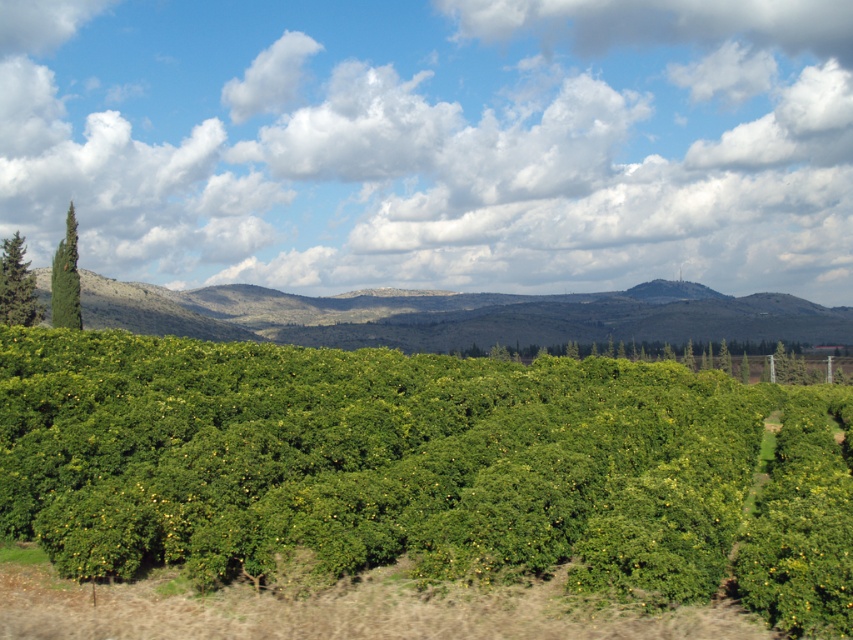
Who is positioned more to the left, green leafy hedge at center or green leafy hillside at center?

green leafy hedge at center

Does green leafy hedge at center appear under green leafy hillside at center?

Yes.

Is point (798, 472) positioned behind point (364, 304)?

No, (798, 472) is closer to viewer.

The image size is (853, 640). Identify the location of green leafy hedge at center. (421, 468).

Is point (445, 332) in front of point (74, 272)?

That is False.

Does point (283, 292) come farther from viewer compared to point (68, 300)?

That is True.

This screenshot has width=853, height=640. What do you see at coordinates (459, 316) in the screenshot? I see `green leafy hillside at center` at bounding box center [459, 316].

Identify the location of green leafy hillside at center. (459, 316).

Is green leafy hillside at center behind green leafy tree at left?

Yes, it is.

Which is above, green leafy hillside at center or green leafy tree at left?

green leafy tree at left is above.

The height and width of the screenshot is (640, 853). What do you see at coordinates (459, 316) in the screenshot? I see `green leafy hillside at center` at bounding box center [459, 316].

You are a GUI agent. You are given a task and a screenshot of the screen. Output one action in this format:
    pyautogui.click(x=<x>, y=<y>)
    Task: Click on the green leafy hillside at center
    
    Given the screenshot: What is the action you would take?
    pyautogui.click(x=459, y=316)